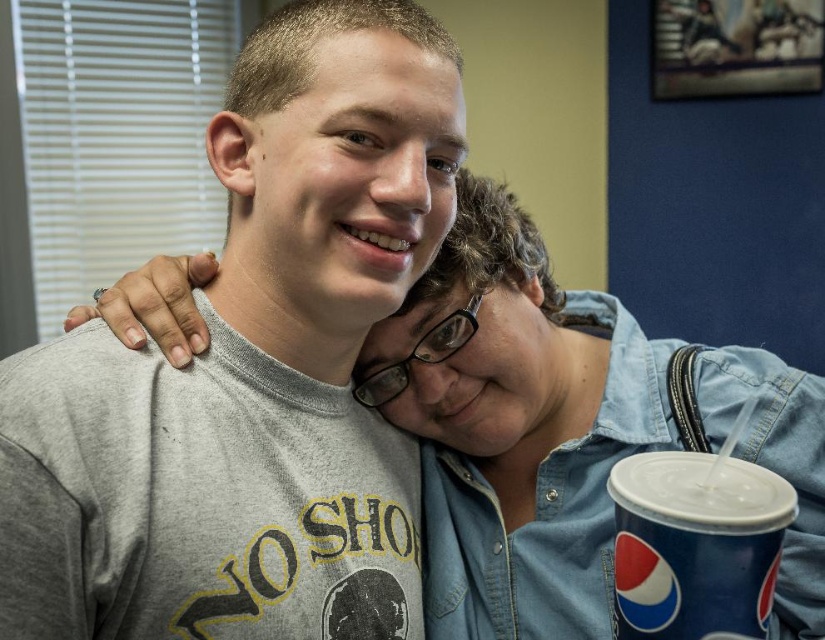
Measure the distance between point (338,440) and camera.

Point (338,440) and camera are 32.42 inches apart from each other.

Can you confirm if gray matte t-shirt at upper left is thinner than blue paper cup at lower right?

In fact, gray matte t-shirt at upper left might be wider than blue paper cup at lower right.

Between point (277, 400) and point (750, 557), which one is positioned behind?

The point (277, 400) is behind.

Where is `gray matte t-shirt at upper left`? This screenshot has width=825, height=640. gray matte t-shirt at upper left is located at coordinates (251, 371).

Can you confirm if denim jacket at center is taller than blue paper cup at lower right?

Yes, denim jacket at center is taller than blue paper cup at lower right.

Is point (522, 278) behind point (615, 515)?

That is True.

Looking at this image, who is more forward, (x=474, y=609) or (x=767, y=484)?

Point (x=767, y=484) is more forward.

Find the location of a particular element. The width and height of the screenshot is (825, 640). denim jacket at center is located at coordinates (564, 432).

Which is more to the right, gray matte t-shirt at upper left or denim jacket at center?

denim jacket at center is more to the right.

Does point (371, 8) come in front of point (550, 440)?

Yes, it is.

Which is behind, point (165, 616) or point (812, 484)?

The point (812, 484) is behind.

This screenshot has height=640, width=825. Identify the location of gray matte t-shirt at upper left. (251, 371).